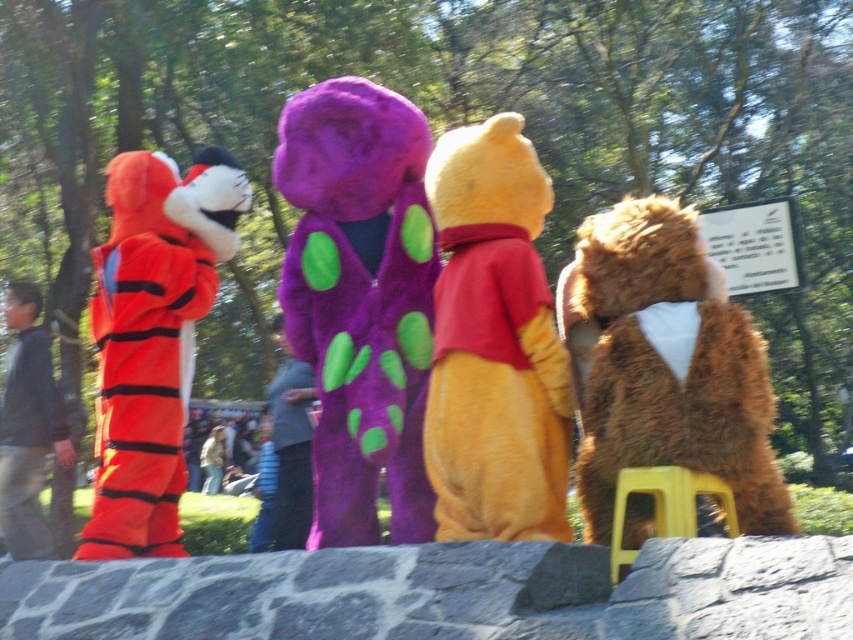
Is fuzzy brown teddy bear at right smaller than velvet purple costume at center?

Incorrect, fuzzy brown teddy bear at right is not smaller in size than velvet purple costume at center.

Does fuzzy brown teddy bear at right appear on the left side of velvet purple costume at center?

In fact, fuzzy brown teddy bear at right is to the right of velvet purple costume at center.

What do you see at coordinates (665, 365) in the screenshot?
I see `fuzzy brown teddy bear at right` at bounding box center [665, 365].

In order to click on fuzzy brown teddy bear at right in this screenshot , I will do click(x=665, y=365).

This screenshot has height=640, width=853. Describe the element at coordinates (360, 300) in the screenshot. I see `purple fuzzy teddy at center` at that location.

Can you confirm if purple fuzzy teddy at center is taller than dark gray sweater at left?

Yes, purple fuzzy teddy at center is taller than dark gray sweater at left.

You are a GUI agent. You are given a task and a screenshot of the screen. Output one action in this format:
    pyautogui.click(x=<x>, y=<y>)
    Task: Click on the purple fuzzy teddy at center
    
    Given the screenshot: What is the action you would take?
    pyautogui.click(x=360, y=300)

Does orange plush teddy bear at left have a lesser height compared to dark gray sweater at left?

Incorrect, orange plush teddy bear at left's height does not fall short of dark gray sweater at left's.

What do you see at coordinates (152, 337) in the screenshot? The image size is (853, 640). I see `orange plush teddy bear at left` at bounding box center [152, 337].

Is point (152, 326) more distant than point (45, 445)?

No, (152, 326) is in front of (45, 445).

I want to click on orange plush teddy bear at left, so tap(152, 337).